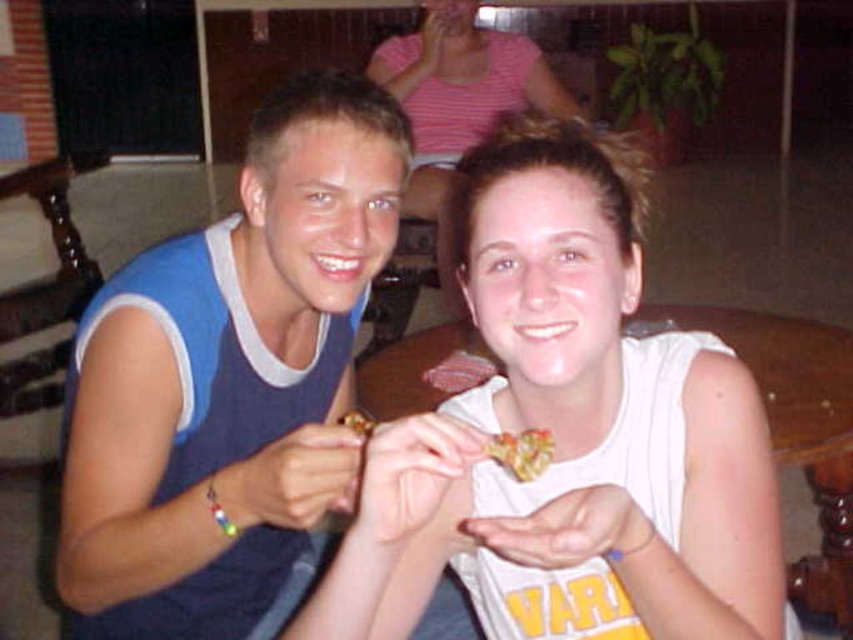
Question: Is white matte food at center below smooth white tank top at center?

Choices:
 (A) yes
 (B) no

Answer: (A)

Question: Which point is farther from the camera taking this photo?

Choices:
 (A) (331, 589)
 (B) (527, 428)

Answer: (B)

Question: Can you confirm if white matte food at center is positioned below smooth white tank top at center?

Choices:
 (A) no
 (B) yes

Answer: (B)

Question: Which object is closer to the camera taking this photo?

Choices:
 (A) smooth white tank top at center
 (B) white matte food at center
 (C) blue jersey at center

Answer: (B)

Question: Among these objects, which one is farthest from the camera?

Choices:
 (A) blue jersey at center
 (B) shiny metallic snack at center
 (C) white matte food at center
 (D) smooth white tank top at center

Answer: (D)

Question: Can you confirm if blue jersey at center is smaller than smooth white tank top at center?

Choices:
 (A) yes
 (B) no

Answer: (A)